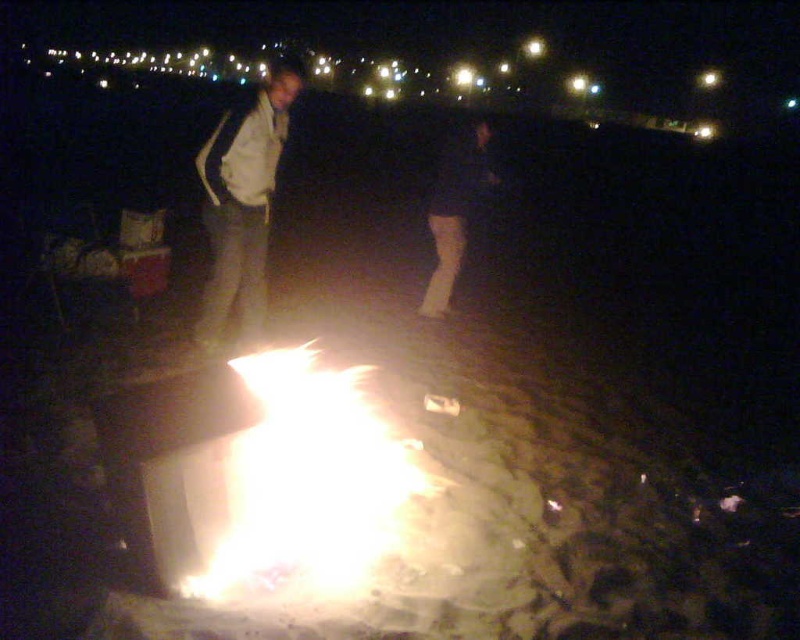
You are planning to place a small camping stool between the flaming wood at center and the white matte jacket at center. Based on their sizes, can the stool fit between them without touching either?

The flaming wood at center might be wider than the white matte jacket at center, so there might not be enough space for the stool to fit between them without touching either object.

You are standing at the fire pit and want to walk towards the two people in the background. Which point, point (262,563) or point (448,193), is closer to you?

Point (262,563) is closer to you because it is in front of point (448,193).

You are standing near the fire and want to hand a marshmallow to the person wearing the white matte jacket at center and dark blue jeans at center. Which clothing item should you reach toward first to ensure you touch the correct person?

The white matte jacket at center is below dark blue jeans at center, so you should reach toward the dark blue jeans at center first since it is higher up and part of the same person.